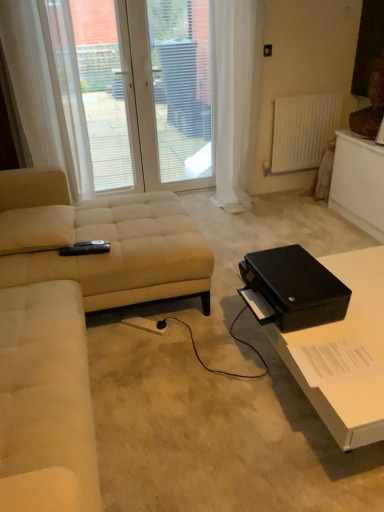
Where is `free space to the left of white glossy table at lower right`? The image size is (384, 512). free space to the left of white glossy table at lower right is located at coordinates (201, 404).